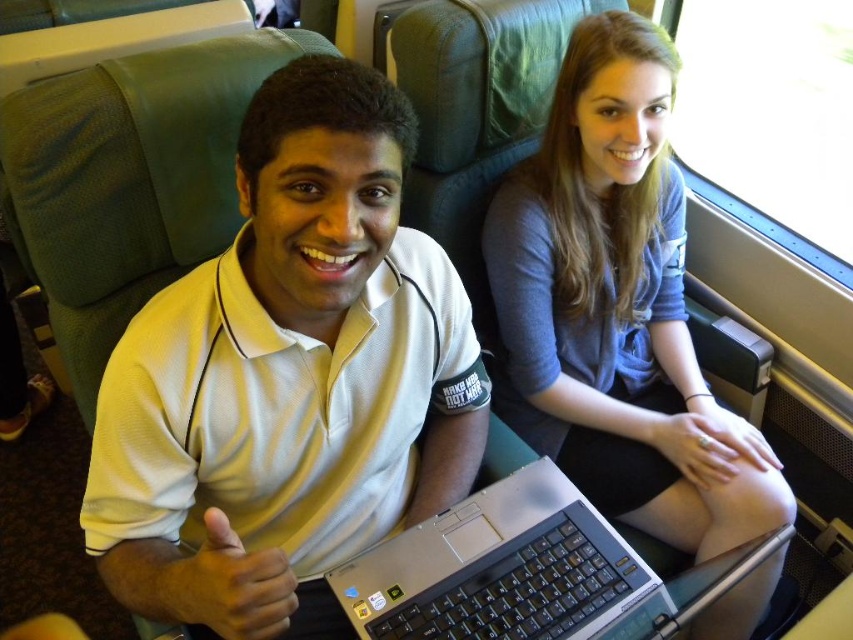
You are a photographer trying to capture a candid shot of the white matte shirt at center and the silver metallic laptop at center in the train compartment. Since you want to focus on the shirt and laptop, which one should you adjust your camera focus on first to ensure both are in sharp focus?

The white matte shirt at center is above the silver metallic laptop at center, so you should focus on the silver metallic laptop at center first to ensure both are in sharp focus.

You are a passenger on a train and want to place your phone on the seat next to you without blocking the silver metallic laptop at center. Where should you place it in relation to the matte gray sweater at upper right?

Place the phone below the matte gray sweater at upper right so it doesn